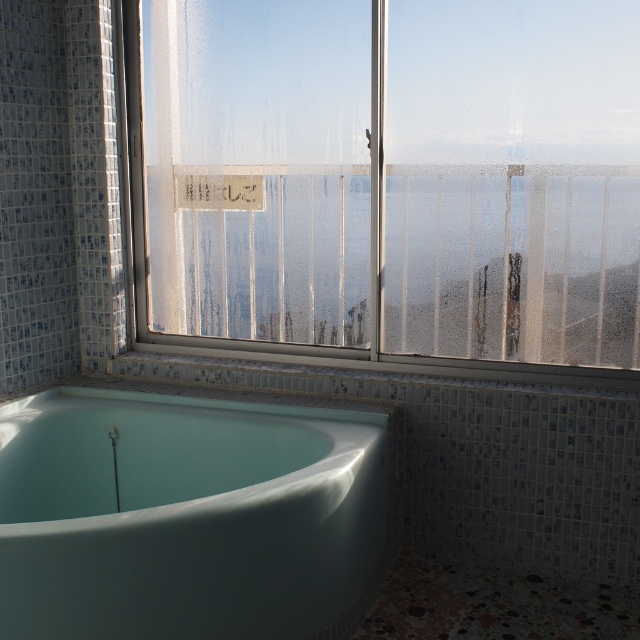
Question: Where is frosted glass window at upper center located in relation to matte white bathtub at lower left in the image?

Choices:
 (A) right
 (B) left

Answer: (A)

Question: Can you confirm if frosted glass window at upper center is wider than matte white bathtub at lower left?

Choices:
 (A) no
 (B) yes

Answer: (B)

Question: Considering the relative positions of frosted glass window at upper center and matte white bathtub at lower left in the image provided, where is frosted glass window at upper center located with respect to matte white bathtub at lower left?

Choices:
 (A) above
 (B) below

Answer: (A)

Question: Which object is farther from the camera taking this photo?

Choices:
 (A) matte white bathtub at lower left
 (B) frosted glass window at upper center

Answer: (B)